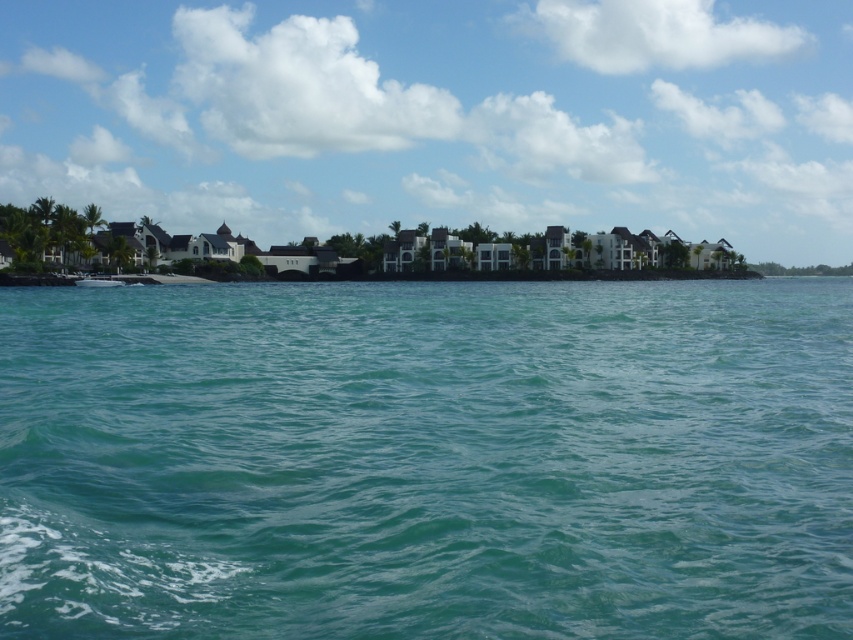
Is teal water at center to the left of white glossy boat at center from the viewer's perspective?

Incorrect, teal water at center is not on the left side of white glossy boat at center.

Measure the distance between point (712, 358) and camera.

Point (712, 358) and camera are 24.69 meters apart from each other.

The width and height of the screenshot is (853, 640). In order to click on teal water at center in this screenshot , I will do `click(427, 460)`.